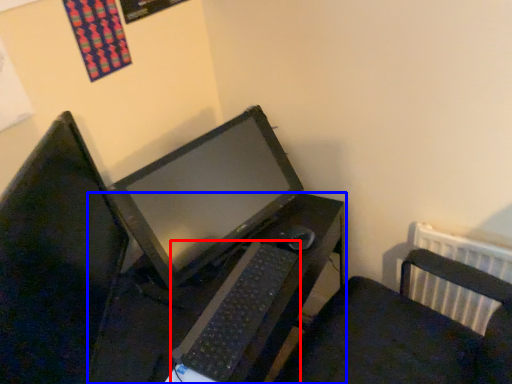
Question: Which object is closer to the camera taking this photo, computer keyboard (highlighted by a red box) or desk (highlighted by a blue box)?

Choices:
 (A) computer keyboard
 (B) desk

Answer: (B)